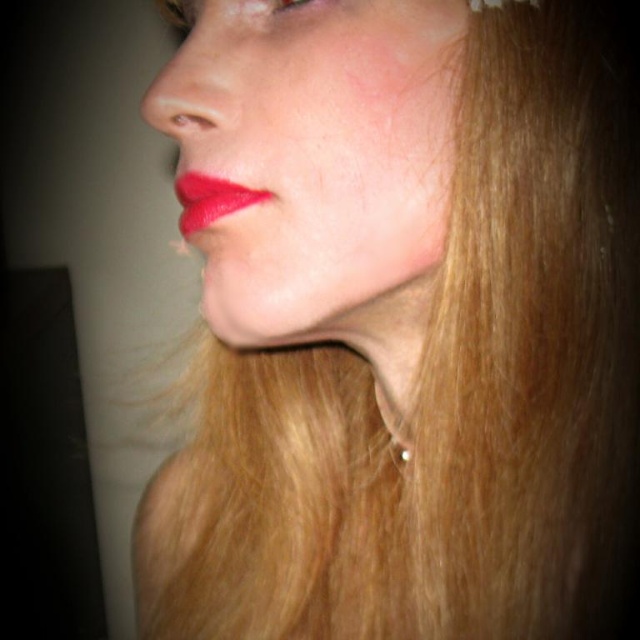
Is matte red lips at center positioned behind pearl-like earring at center?

No, matte red lips at center is closer to the viewer.

Can you confirm if matte red lips at center is positioned to the left of pearl-like earring at center?

Indeed, matte red lips at center is positioned on the left side of pearl-like earring at center.

Who is more forward, (268, 195) or (404, 451)?

Point (268, 195) is in front.

Identify the location of matte red lips at center. The height and width of the screenshot is (640, 640). [211, 198].